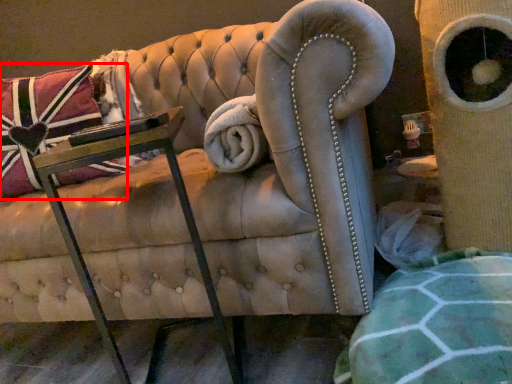
Question: In this image, where is throw pillow (annotated by the red box) located relative to table?

Choices:
 (A) left
 (B) right

Answer: (A)